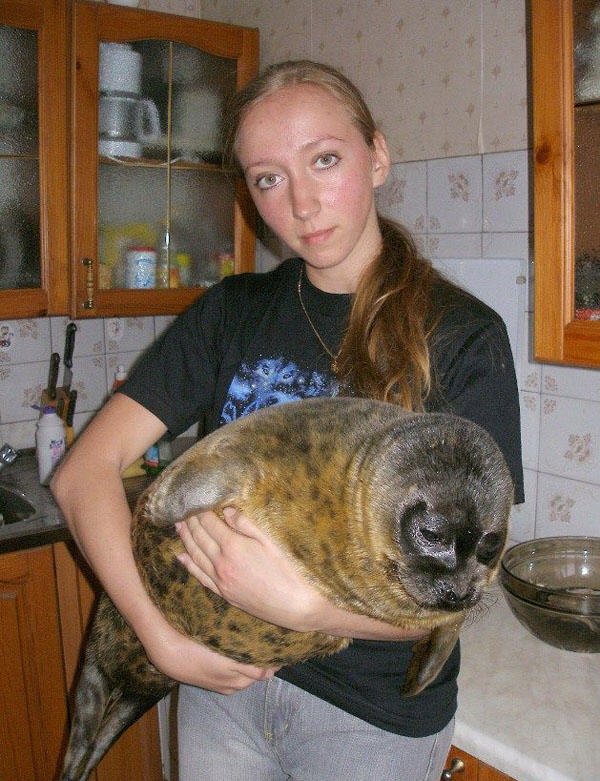
You are a GUI agent. You are given a task and a screenshot of the screen. Output one action in this format:
    pyautogui.click(x=<x>, y=<y>)
    Task: Click on the knob
    
    Given the screenshot: What is the action you would take?
    pyautogui.click(x=450, y=774)